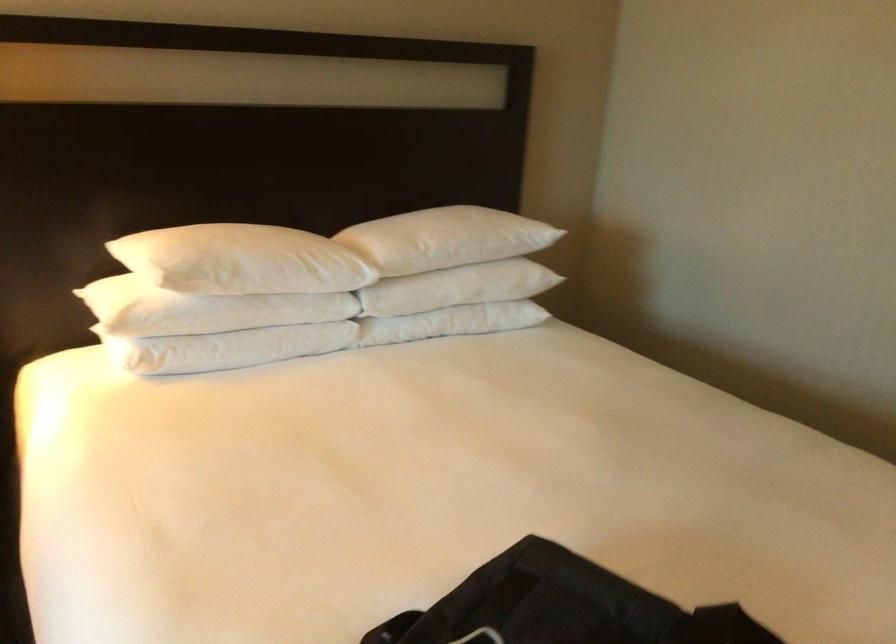
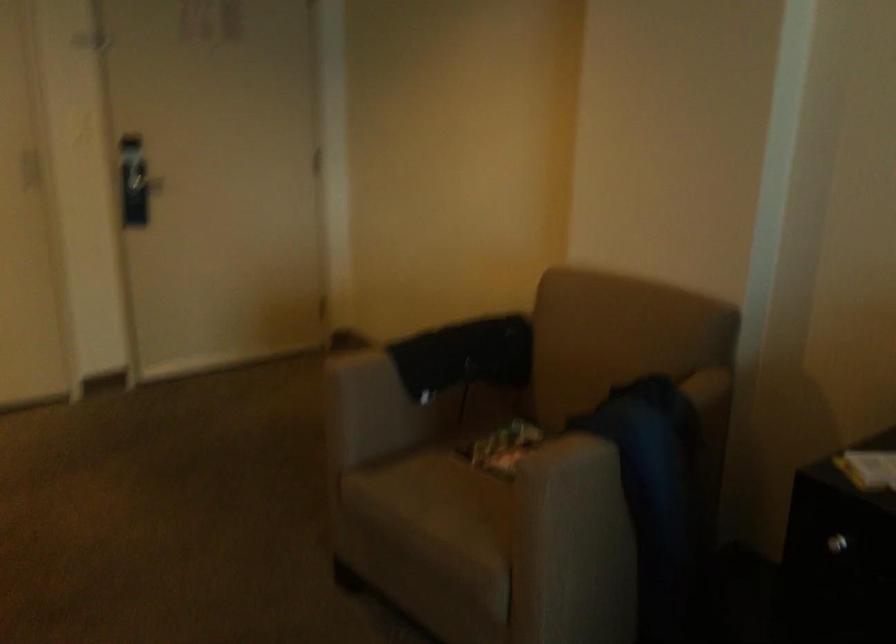
Looking at this image, how did the camera likely rotate?

The camera rotated toward right-down.